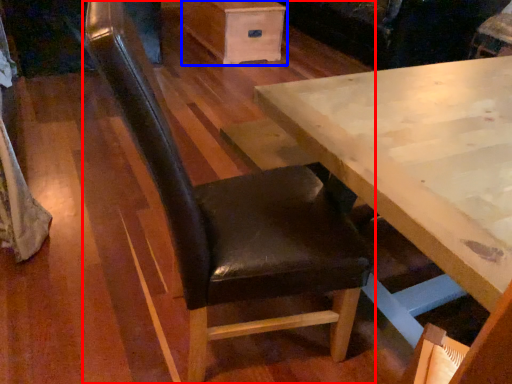
Question: Which of the following is the farthest to the observer, chair (highlighted by a red box) or drawer (highlighted by a blue box)?

Choices:
 (A) chair
 (B) drawer

Answer: (B)